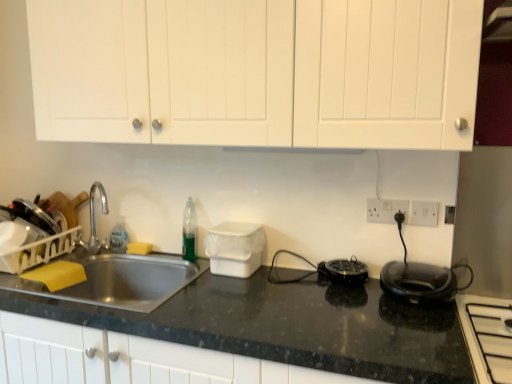
What do you see at coordinates (119, 237) in the screenshot? I see `translucent green bottle at sink` at bounding box center [119, 237].

The width and height of the screenshot is (512, 384). I want to click on white glossy stovetop at lower right, so click(487, 337).

Describe the element at coordinates (234, 248) in the screenshot. I see `white plastic container at center, the first appliance viewed from the left` at that location.

This screenshot has height=384, width=512. Identify the location of black granite countertop at center. (290, 326).

What do you see at coordinates (344, 271) in the screenshot?
I see `black plastic appliance at center, which ranks as the first appliance in right-to-left order` at bounding box center [344, 271].

The image size is (512, 384). Describe the element at coordinates (418, 282) in the screenshot. I see `black glossy electric kettle at right` at that location.

Image resolution: width=512 pixels, height=384 pixels. Find the location of `black glossy electric kettle at right`. black glossy electric kettle at right is located at coordinates (418, 282).

This screenshot has height=384, width=512. What do you see at coordinates (257, 72) in the screenshot?
I see `white matte cabinet doors at upper center` at bounding box center [257, 72].

In order to click on translucent green bottle at sink in this screenshot , I will do click(x=119, y=237).

Based on the photo, is black granite countertop at center at the left side of white glossy stovetop at lower right?

Correct, you'll find black granite countertop at center to the left of white glossy stovetop at lower right.

Which of these two, black granite countertop at center or white glossy stovetop at lower right, is thinner?

white glossy stovetop at lower right.

Which is behind, point (446, 328) or point (493, 342)?

Positioned behind is point (446, 328).

From the picture: Would you consider black granite countertop at center to be distant from white glossy stovetop at lower right?

That's not correct — black granite countertop at center is a little close to white glossy stovetop at lower right.

How different are the orientations of black plastic appliance at center, the second appliance in the left-to-right sequence, and white plastic container at center, the first appliance viewed from the left, in degrees?

The angular difference between black plastic appliance at center, the second appliance in the left-to-right sequence, and white plastic container at center, the first appliance viewed from the left, is 0.000246 degrees.

Is black plastic appliance at center, the second appliance in the left-to-right sequence, turned away from white plastic container at center, the second appliance when ordered from right to left?

black plastic appliance at center, the second appliance in the left-to-right sequence, does not have its back to white plastic container at center, the second appliance when ordered from right to left.

Is black plastic appliance at center, the second appliance in the left-to-right sequence, far away from white plastic container at center, the second appliance when ordered from right to left?

No.

Is black glossy electric kettle at right inside or outside of black granite countertop at center?

black glossy electric kettle at right is spatially situated outside black granite countertop at center.

Consider the image. Is black glossy electric kettle at right not near black granite countertop at center?

black glossy electric kettle at right is near black granite countertop at center, not far away.

Considering their positions, is black glossy electric kettle at right located in front of or behind black granite countertop at center?

Visually, black glossy electric kettle at right is located behind black granite countertop at center.

Measure the distance between black glossy electric kettle at right and black granite countertop at center.

13.34 inches.

Between point (212, 233) and point (77, 316), which one is positioned behind?

The point (212, 233) is farther.

Based on the photo, between white plastic container at center, the second appliance when ordered from right to left, and black granite countertop at center, which one has larger size?

Bigger between the two is black granite countertop at center.

Are white plastic container at center, the first appliance viewed from the left, and black granite countertop at center making contact?

No, white plastic container at center, the first appliance viewed from the left, is not next to black granite countertop at center.

Does white plastic container at center, the first appliance viewed from the left, have a greater width compared to black granite countertop at center?

No.

Considering the relative sizes of white glossy stovetop at lower right and white plastic electric outlet at upper right, marked as the first electric outlet in a right-to-left arrangement, in the image provided, is white glossy stovetop at lower right taller than white plastic electric outlet at upper right, marked as the first electric outlet in a right-to-left arrangement,?

Correct, white glossy stovetop at lower right is much taller as white plastic electric outlet at upper right, marked as the first electric outlet in a right-to-left arrangement.

Are white glossy stovetop at lower right and white plastic electric outlet at upper right, marked as the first electric outlet in a right-to-left arrangement, located far from each other?

Actually, white glossy stovetop at lower right and white plastic electric outlet at upper right, marked as the first electric outlet in a right-to-left arrangement, are a little close together.

Does white glossy stovetop at lower right turn towards white plastic electric outlet at upper right, positioned as the second electric outlet in left-to-right order?

No, white glossy stovetop at lower right is not turned towards white plastic electric outlet at upper right, positioned as the second electric outlet in left-to-right order.

Would you say white glossy stovetop at lower right is to the left or to the right of white plastic electric outlet at upper right, positioned as the second electric outlet in left-to-right order, in the picture?

From the image, it's evident that white glossy stovetop at lower right is to the right of white plastic electric outlet at upper right, positioned as the second electric outlet in left-to-right order.

Considering the sizes of objects white plastic electric outlet at upper right, positioned as the second electric outlet in left-to-right order, and white glossy stovetop at lower right in the image provided, who is bigger, white plastic electric outlet at upper right, positioned as the second electric outlet in left-to-right order, or white glossy stovetop at lower right?

Bigger between the two is white glossy stovetop at lower right.

Does point (419, 221) come farther from viewer compared to point (476, 296)?

Yes, it is behind point (476, 296).

Is white plastic electric outlet at upper right, positioned as the second electric outlet in left-to-right order, positioned with its back to white glossy stovetop at lower right?

No, white plastic electric outlet at upper right, positioned as the second electric outlet in left-to-right order, is not facing away from white glossy stovetop at lower right.

Is black glossy electric kettle at right taller or shorter than white matte cabinet doors at upper center?

In the image, black glossy electric kettle at right appears to be shorter than white matte cabinet doors at upper center.

Is black glossy electric kettle at right far from white matte cabinet doors at upper center?

black glossy electric kettle at right is actually quite close to white matte cabinet doors at upper center.

Considering their positions, is black glossy electric kettle at right located in front of or behind white matte cabinet doors at upper center?

black glossy electric kettle at right is behind white matte cabinet doors at upper center.

Image resolution: width=512 pixels, height=384 pixels. I want to click on countertop below the white glossy stovetop at lower right (from the image's perspective), so click(290, 326).

The image size is (512, 384). I want to click on appliance on the left side of black plastic appliance at center, which ranks as the first appliance in right-to-left order, so click(234, 248).

When comparing their distances from black glossy electric kettle at right, does white glossy stovetop at lower right or black granite countertop at center seem further?

black granite countertop at center lies further to black glossy electric kettle at right than the other object.

Which object lies nearer to the anchor point black granite countertop at center, white plastic electric outlet at right, which is the 1th electric outlet in left-to-right order, or translucent green bottle at sink?

white plastic electric outlet at right, which is the 1th electric outlet in left-to-right order, lies closer to black granite countertop at center than the other object.

Based on their spatial positions, is white plastic electric outlet at upper right, marked as the first electric outlet in a right-to-left arrangement, or white plastic electric outlet at right, which is the 1th electric outlet in left-to-right order, closer to black glossy electric kettle at right?

Among the two, white plastic electric outlet at upper right, marked as the first electric outlet in a right-to-left arrangement, is located nearer to black glossy electric kettle at right.

Which object lies further to the anchor point black granite countertop at center, black glossy electric kettle at right or black plastic appliance at center, the second appliance in the left-to-right sequence?

black glossy electric kettle at right.

When comparing their distances from translucent green bottle at sink, does white plastic electric outlet at right, which ranks as the second electric outlet in right-to-left order, or black glossy electric kettle at right seem closer?

white plastic electric outlet at right, which ranks as the second electric outlet in right-to-left order, lies closer to translucent green bottle at sink than the other object.

Based on their spatial positions, is black glossy electric kettle at right or white plastic electric outlet at right, which is the 1th electric outlet in left-to-right order, closer to black granite countertop at center?

Among the two, black glossy electric kettle at right is located nearer to black granite countertop at center.

From the image, which object appears to be farther from translucent green bottle at sink, black glossy electric kettle at right or white plastic container at center, the second appliance when ordered from right to left?

black glossy electric kettle at right is further to translucent green bottle at sink.

Considering their positions, is white glossy stovetop at lower right positioned closer to white matte cabinet doors at upper center than white plastic electric outlet at right, which is the 1th electric outlet in left-to-right order?

Based on the image, white plastic electric outlet at right, which is the 1th electric outlet in left-to-right order, appears to be nearer to white matte cabinet doors at upper center.

Identify the location of electric outlet between black granite countertop at center and black glossy electric kettle at right from left to right. The image size is (512, 384). (386, 210).

Where is `kitchen appliance between white glossy stovetop at lower right and white plastic electric outlet at upper right, positioned as the second electric outlet in left-to-right order, from front to back`? This screenshot has width=512, height=384. kitchen appliance between white glossy stovetop at lower right and white plastic electric outlet at upper right, positioned as the second electric outlet in left-to-right order, from front to back is located at coordinates (418, 282).

Where is `countertop between translucent green bottle at sink and white glossy stovetop at lower right from left to right`? This screenshot has height=384, width=512. countertop between translucent green bottle at sink and white glossy stovetop at lower right from left to right is located at coordinates (290, 326).

Locate an element on the screen. The width and height of the screenshot is (512, 384). kitchen appliance between black granite countertop at center and white glossy stovetop at lower right from left to right is located at coordinates (418, 282).